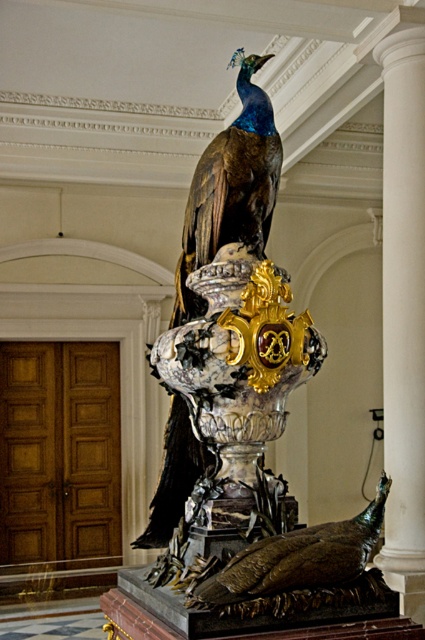
Question: Is shiny bronze peacock at upper center above shiny bronze peacock at center?

Choices:
 (A) no
 (B) yes

Answer: (B)

Question: Which point is closer to the camera?

Choices:
 (A) shiny bronze peacock at upper center
 (B) shiny bronze peacock at center

Answer: (A)

Question: Where is shiny bronze peacock at upper center located in relation to shiny blue peacock at center in the image?

Choices:
 (A) right
 (B) left

Answer: (B)

Question: Among these points, which one is nearest to the camera?

Choices:
 (A) (401, 316)
 (B) (252, 516)
 (C) (249, 88)
 (D) (223, 538)

Answer: (D)

Question: Where is shiny bronze peacock at upper center located in relation to shiny bronze peacock at center in the image?

Choices:
 (A) below
 (B) above

Answer: (B)

Question: Considering the real-world distances, which object is closest to the shiny blue peacock at center?

Choices:
 (A) shiny bronze peacock at upper center
 (B) white marble column at center

Answer: (A)